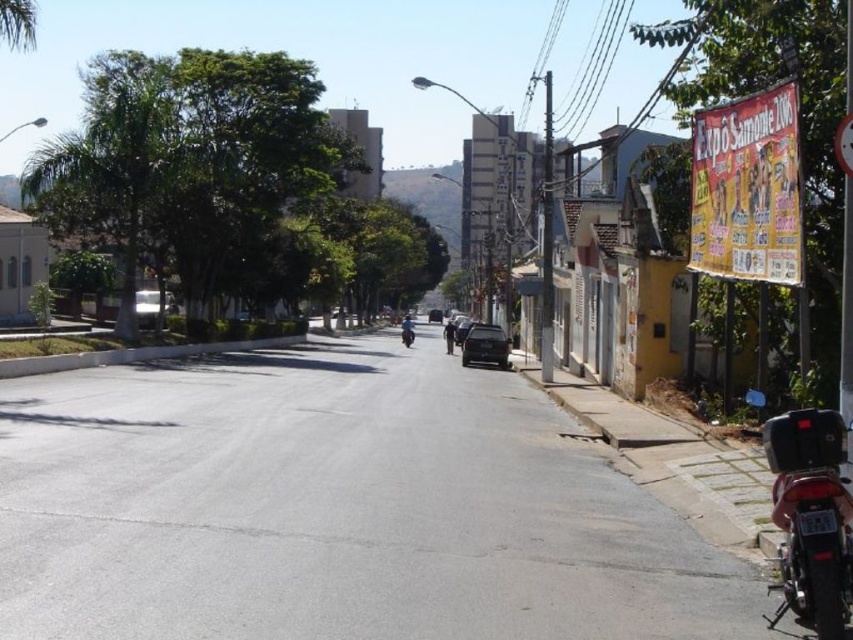
Question: Considering the relative positions of shiny black motorcycle at lower right and metallic silver car at left in the image provided, where is shiny black motorcycle at lower right located with respect to metallic silver car at left?

Choices:
 (A) below
 (B) above

Answer: (A)

Question: Which of these objects is positioned closest to the matte black car at center?

Choices:
 (A) metallic silver car at left
 (B) blue matte motorcycle at center
 (C) shiny black motorcycle at lower right

Answer: (B)

Question: Which object is the farthest from the matte black car at center?

Choices:
 (A) blue matte motorcycle at center
 (B) shiny black motorcycle at lower right
 (C) satin black car at center

Answer: (B)

Question: Does blue matte motorcycle at center appear on the left side of shiny black motorcycle at center?

Choices:
 (A) no
 (B) yes

Answer: (B)

Question: Which point is farther to the camera?

Choices:
 (A) shiny black motorcycle at center
 (B) matte black car at center
 (C) satin black car at center
 (D) shiny black motorcycle at lower right

Answer: (B)

Question: Is shiny black motorcycle at lower right bigger than shiny black motorcycle at center?

Choices:
 (A) yes
 (B) no

Answer: (B)